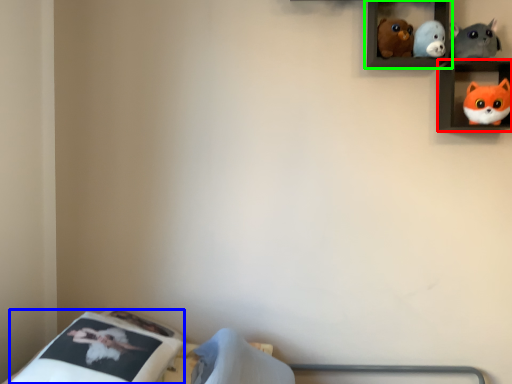
Question: Considering the real-world distances, which object is closest to shelf (highlighted by a red box)? mattress (highlighted by a blue box) or shelf (highlighted by a green box).

Choices:
 (A) mattress
 (B) shelf

Answer: (B)